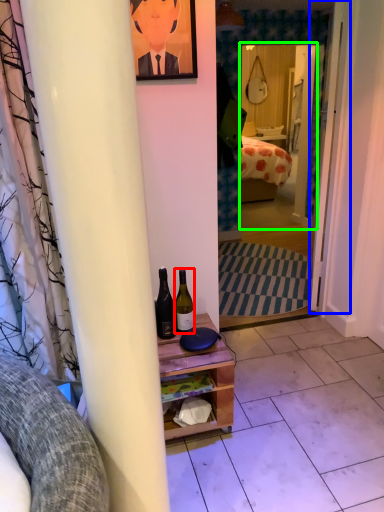
Question: Which is farther away from bottle (highlighted by a red box)? door (highlighted by a blue box) or mirror (highlighted by a green box)?

Choices:
 (A) door
 (B) mirror

Answer: (B)